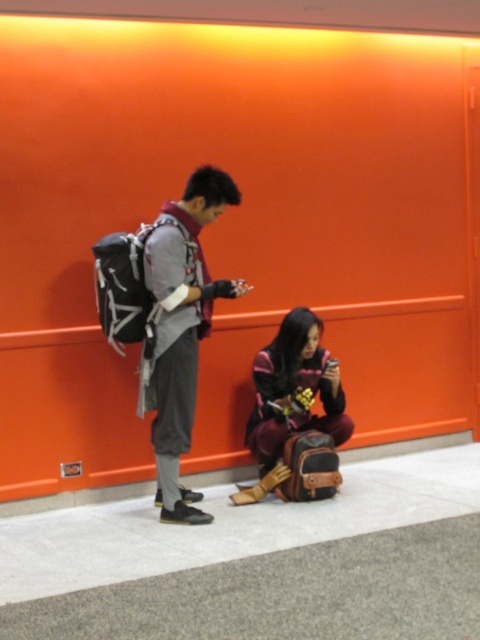
Is matte black backpack at left below maroon fabric bag at lower center?

Incorrect, matte black backpack at left is not positioned below maroon fabric bag at lower center.

The width and height of the screenshot is (480, 640). Describe the element at coordinates (180, 330) in the screenshot. I see `matte black backpack at left` at that location.

Where is `matte black backpack at left`? This screenshot has width=480, height=640. matte black backpack at left is located at coordinates (180, 330).